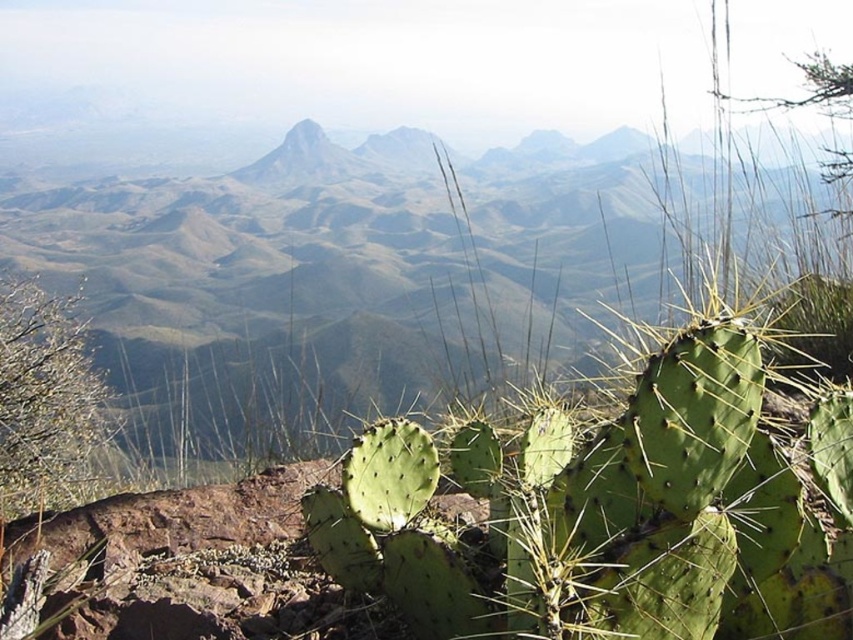
You are standing in the mountainous landscape and want to walk from point A to point B. Point A is at coordinate point (x=132, y=364) and point B is at coordinate point (x=85, y=364). Which point is closer to you when you start walking?

Point A at coordinate point (x=132, y=364) is closer to you than point B at coordinate point (x=85, y=364) because it is further to the viewer.

You are standing in the desert and see the green textured mountain range at center and the green spiny cactus at lower left. Which object is positioned to the right of the other?

The green textured mountain range at center is to the right of the green spiny cactus at lower left.

You are an aerial photographer planning to capture the green textured mountain range at center. Based on the scene description, where should you position your camera to ensure the mountain range is centered in the photo?

The green textured mountain range at center is already positioned at the center of the image at coordinates point [352,275], so positioning the camera to aim directly at this point will ensure the mountain range is centered in the photo.